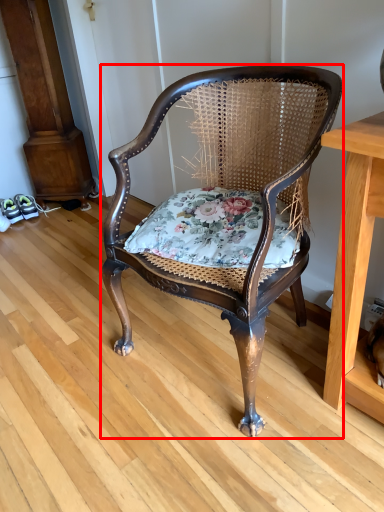
Question: From the image's perspective, considering the relative positions of chair (annotated by the red box) and blanket in the image provided, where is chair (annotated by the red box) located with respect to the staircase?

Choices:
 (A) above
 (B) below

Answer: (B)